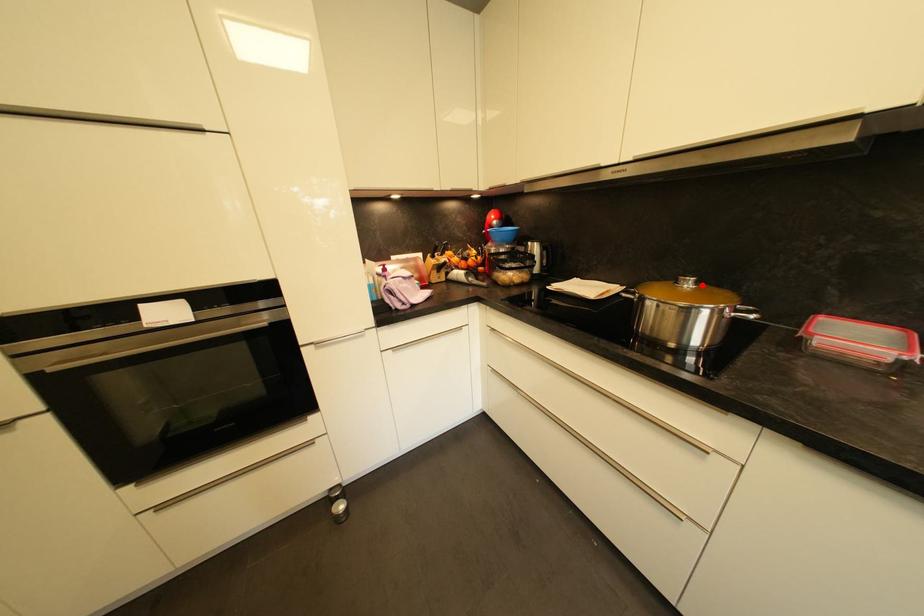
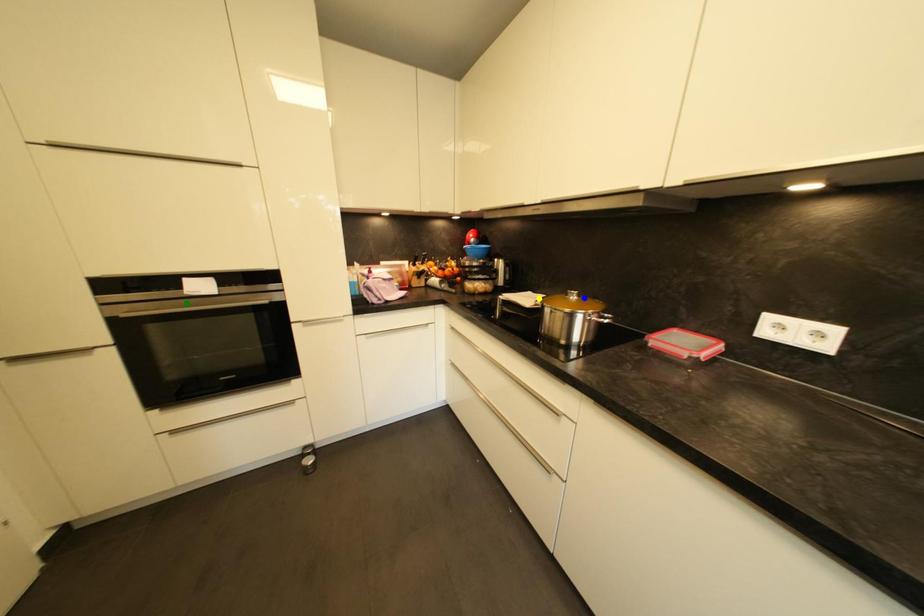
Question: I am providing you with two images of the same scene from different viewpoints. A red point is marked on the first image. You are given multiple points on the second image. Which point in image 2 represents the same 3d spot as the red point in image 1?

Choices:
 (A) green point
 (B) blue point
 (C) yellow point

Answer: (B)